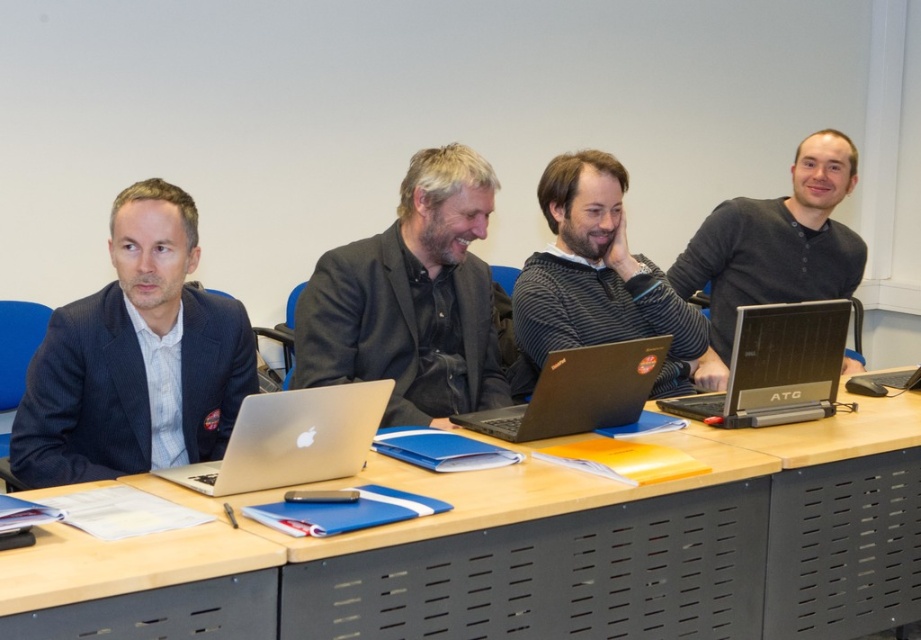
You are organizing a meeting and need to place a 3cm thick document folder between the blue textured blazer at left and the black matte laptop at center. Can the folder fit between them?

The blue textured blazer at left is thinner than the black matte laptop at center. The folder is 3cm thick. Since the blazer is thinner, the space between them might be sufficient, but the exact fit depends on the distance between the two objects. However, based on the given information, we cannot determine if the 3cm folder will fit.

You are sitting at the table and want to reach for the silver metallic laptop at center without moving your chair. Can you easily reach it from where you are sitting next to the blue textured blazer at left?

The blue textured blazer at left is closer to you than the silver metallic laptop at center, so you may need to stretch or lean forward to reach the laptop, but it might be within reach depending on your arm length.

You are organizing a presentation and need to access both laptops. The silver metallic laptop at center contains the presentation files, while the black plastic laptop at right has the projector connection. To ensure the projector works, which laptop should you adjust first?

The black plastic laptop at right should be adjusted first because it is connected to the projector. Since the silver metallic laptop at center is positioned under the black plastic laptop at right, you might need to access the black plastic laptop at right first to ensure the projector connection is properly set up.